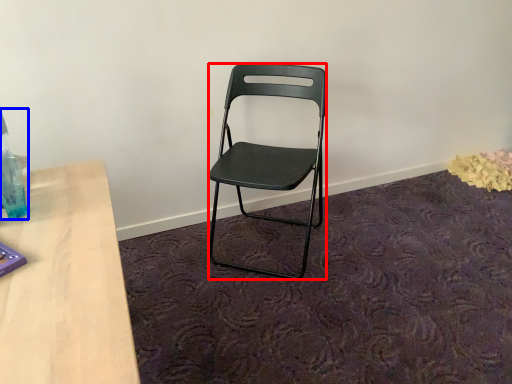
Question: Which of the following is the closest to the observer, chair (highlighted by a red box) or bottle (highlighted by a blue box)?

Choices:
 (A) chair
 (B) bottle

Answer: (B)